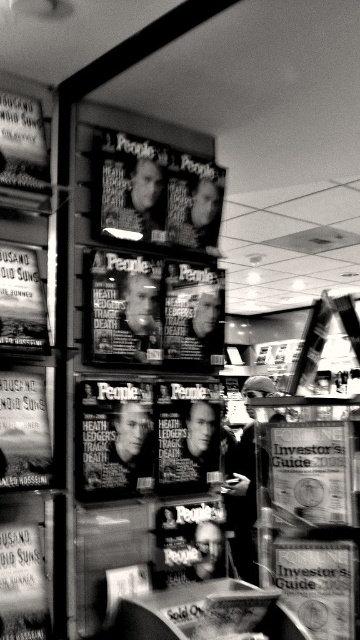
You are a store employee who needs to place a new display between the paperback book at lower right and the matte paper poster at lower left. The display requires a space of 1 meter. Is there enough space between them?

The paperback book at lower right and the matte paper poster at lower left are 1.18 meters apart, so yes, there is enough space to place the display between them since 1.18 meters is greater than the required 1 meter.

You are a store employee who needs to determine if the metallic silver poster at lower left can fit into a storage slot designed for items narrower than the matte black sign at upper left. Can it fit?

The metallic silver poster at lower left is thinner than the matte black sign at upper left, so it can fit into the storage slot designed for items narrower than the matte black sign at upper left.